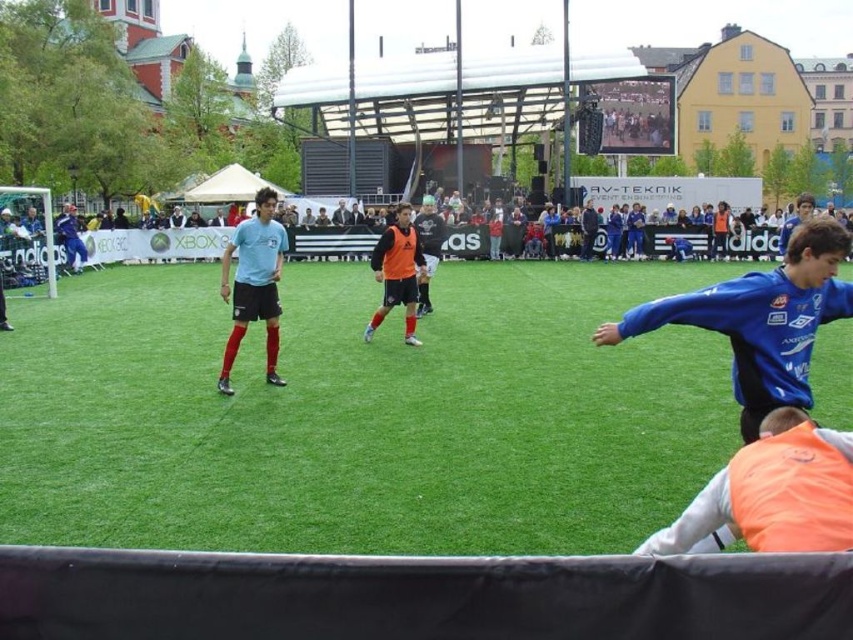
Is orange matte vest at lower right positioned in front of matte blue jersey at center?

Yes, orange matte vest at lower right is closer to the viewer.

The width and height of the screenshot is (853, 640). I want to click on orange matte vest at lower right, so click(x=775, y=492).

Describe the element at coordinates (775, 492) in the screenshot. This screenshot has width=853, height=640. I see `orange matte vest at lower right` at that location.

In order to click on orange matte vest at lower right in this screenshot , I will do `click(775, 492)`.

Does blue jersey at center lie in front of orange matte vest at lower right?

No, it is not.

Who is more distant from viewer, (730, 372) or (766, 448)?

The point (730, 372) is more distant.

This screenshot has height=640, width=853. I want to click on blue jersey at center, so click(761, 320).

The image size is (853, 640). What are the coordinates of `blue jersey at center` in the screenshot? It's located at (761, 320).

Based on the photo, does orange matte vest at lower right appear under orange matte vest at center?

Indeed, orange matte vest at lower right is positioned under orange matte vest at center.

Can you confirm if orange matte vest at lower right is taller than orange matte vest at center?

Incorrect, orange matte vest at lower right's height is not larger of orange matte vest at center's.

Is point (728, 502) behind point (373, 314)?

No, (728, 502) is closer to viewer.

I want to click on orange matte vest at lower right, so click(x=775, y=492).